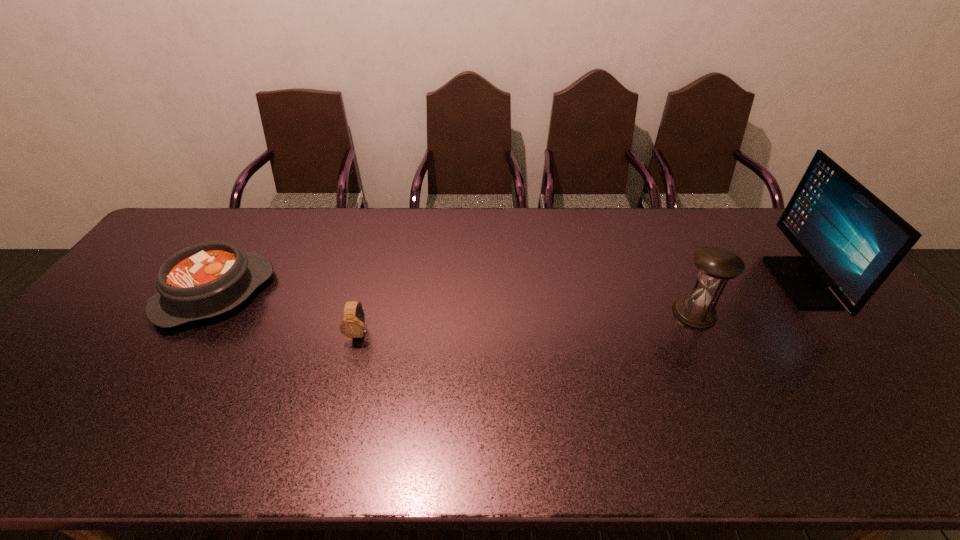
In order to click on monitor in this screenshot , I will do `click(850, 241)`.

This screenshot has height=540, width=960. In order to click on the tallest object in this screenshot , I will do `click(850, 241)`.

Where is `the third object from left to right`? The height and width of the screenshot is (540, 960). the third object from left to right is located at coordinates (716, 265).

Image resolution: width=960 pixels, height=540 pixels. In order to click on the second tallest object in this screenshot , I will do `click(716, 265)`.

In order to click on the leftmost object in this screenshot , I will do `click(207, 279)`.

Where is `the second object from left to right`? Image resolution: width=960 pixels, height=540 pixels. the second object from left to right is located at coordinates (353, 324).

You are a GUI agent. You are given a task and a screenshot of the screen. Output one action in this format:
    pyautogui.click(x=<x>, y=<y>)
    Task: Click on the vacant space located on the screen side of the tallest object
    This screenshot has width=960, height=540.
    Given the screenshot: What is the action you would take?
    pyautogui.click(x=717, y=282)

Find the location of a particular element. vacant space situated 0.340m on the screen side of the tallest object is located at coordinates (667, 282).

Locate an element on the screen. The width and height of the screenshot is (960, 540). free spot located on the screen side of the tallest object is located at coordinates (687, 282).

Find the location of a particular element. This screenshot has height=540, width=960. vacant area situated 0.230m on the back of the third object from left to right is located at coordinates (663, 248).